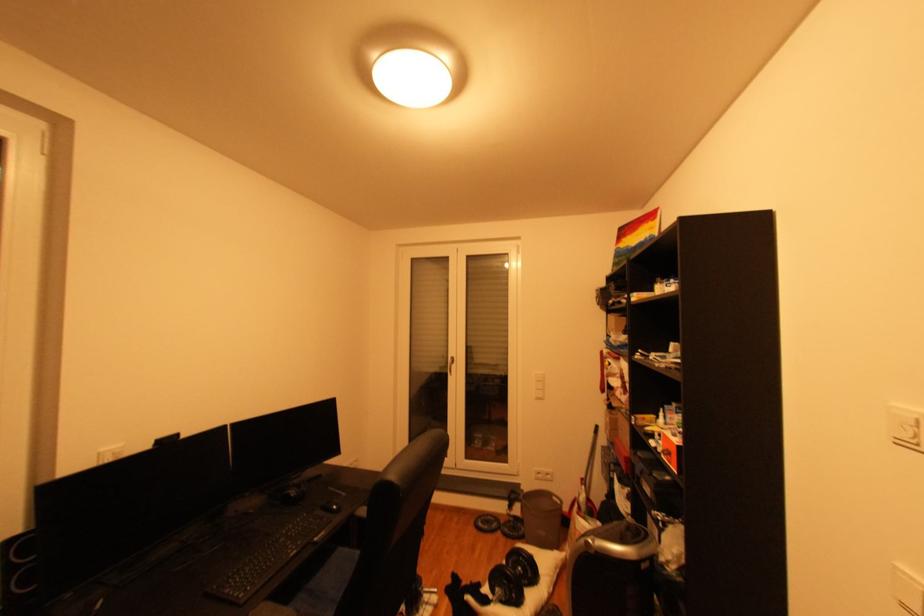
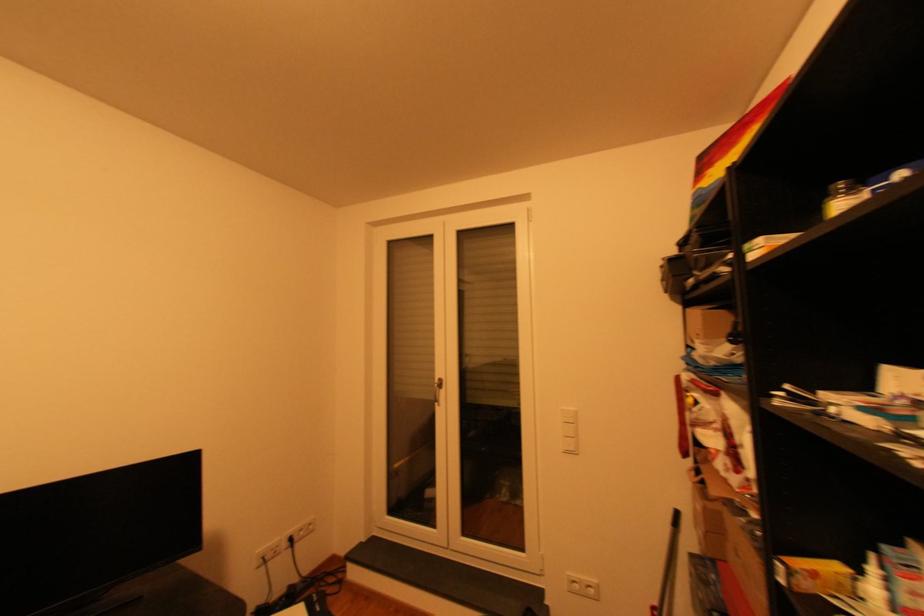
Which direction would the cameraman need to move to produce the second image?

The movement direction of the cameraman is right, forward.